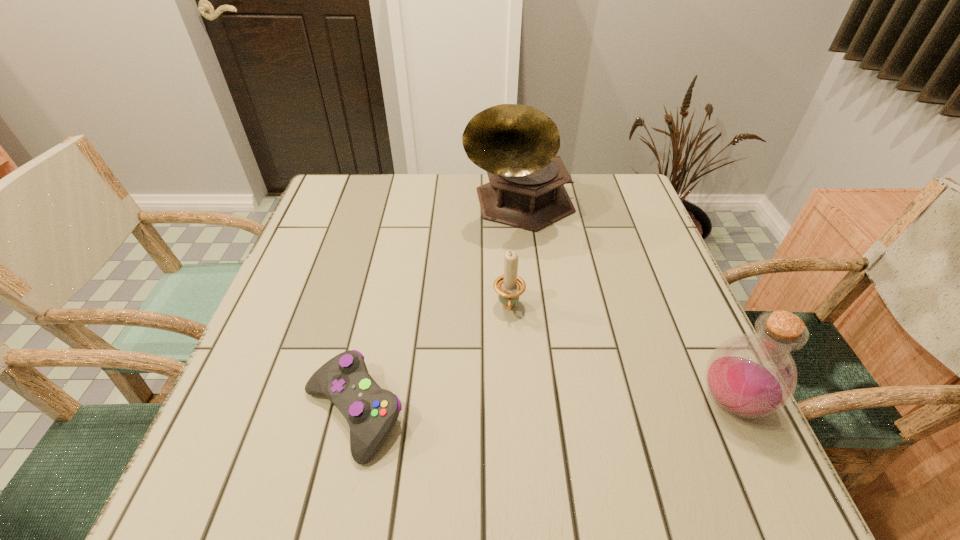
I want to click on object located in the right edge section of the desktop, so click(x=753, y=375).

Locate an element on the screen. object that is at the near left corner is located at coordinates (371, 412).

You are a GUI agent. You are given a task and a screenshot of the screen. Output one action in this format:
    pyautogui.click(x=<x>, y=<y>)
    Task: Click on the object positioned at the near right corner
    The height and width of the screenshot is (540, 960).
    Given the screenshot: What is the action you would take?
    pyautogui.click(x=753, y=375)

The height and width of the screenshot is (540, 960). In the image, there is a desktop. Find the location of `vacant space at the far edge`. vacant space at the far edge is located at coordinates (459, 202).

Where is `vacant space at the near edge`? vacant space at the near edge is located at coordinates (566, 414).

You are a GUI agent. You are given a task and a screenshot of the screen. Output one action in this format:
    pyautogui.click(x=<x>, y=<y>)
    Task: Click on the vacant region at the left edge
    The width and height of the screenshot is (960, 540).
    Given the screenshot: What is the action you would take?
    pyautogui.click(x=358, y=251)

The image size is (960, 540). In the image, there is a desktop. What are the coordinates of `free region at the right edge` in the screenshot? It's located at (632, 345).

The image size is (960, 540). I want to click on free location at the far left corner, so click(x=340, y=192).

The image size is (960, 540). In the image, there is a desktop. What are the coordinates of `vacant space at the near left corner` in the screenshot? It's located at (265, 414).

This screenshot has height=540, width=960. I want to click on vacant space at the far right corner of the desktop, so (627, 193).